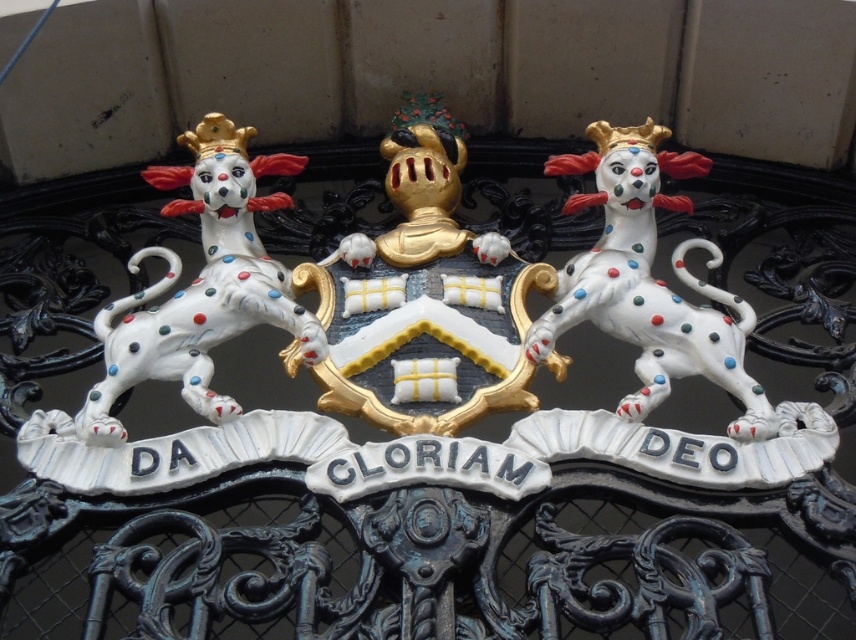
Question: Does white glossy dog at upper left have a larger size compared to polished ceramic dog at center?

Choices:
 (A) yes
 (B) no

Answer: (A)

Question: Does white glossy dog at upper left lie behind polished ceramic dog at center?

Choices:
 (A) yes
 (B) no

Answer: (A)

Question: Which object is the closest to the gold plated shield at center?

Choices:
 (A) white glossy dog at upper left
 (B) polished ceramic dog at center

Answer: (A)

Question: Can you confirm if white glossy dog at upper left is thinner than polished ceramic dog at center?

Choices:
 (A) yes
 (B) no

Answer: (B)

Question: Considering the real-world distances, which object is closest to the polished ceramic dog at center?

Choices:
 (A) gold plated shield at center
 (B) white glossy dog at upper left

Answer: (A)

Question: Which is farther from the gold plated shield at center?

Choices:
 (A) white glossy dog at upper left
 (B) polished ceramic dog at center

Answer: (B)